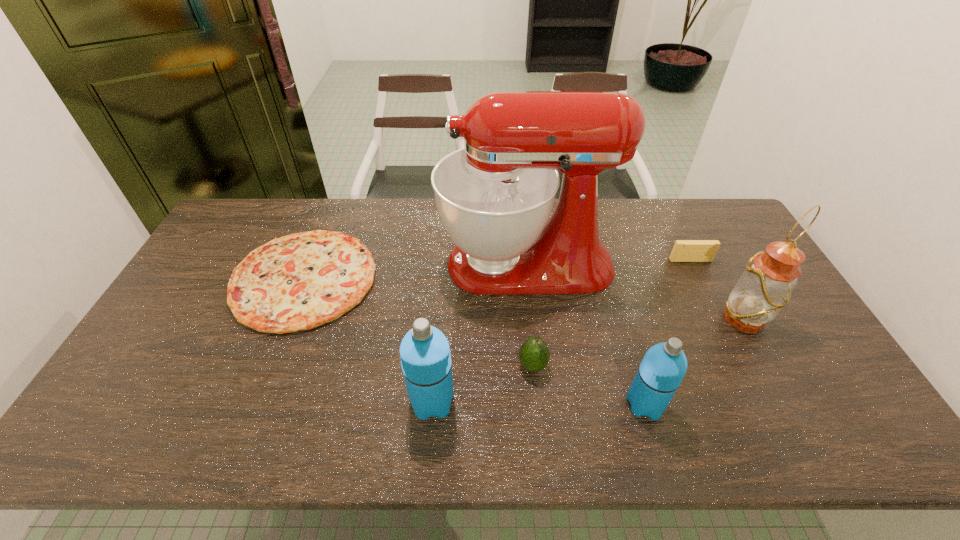
Please show where to add a thermos bottle on the left while keeping spacing even. Please provide its 2D coordinates. Your answer should be formatted as a tuple, i.e. [(x, y)], where the tuple contains the x and y coordinates of a point satisfying the conditions above.

[(222, 399)]